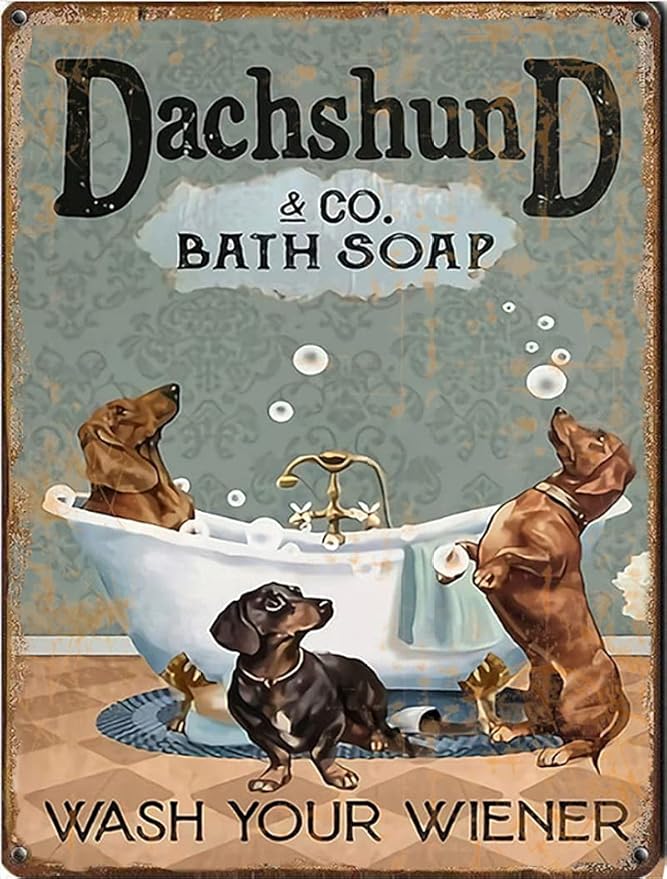
Identify the location of tub. The width and height of the screenshot is (667, 879). (185, 592).